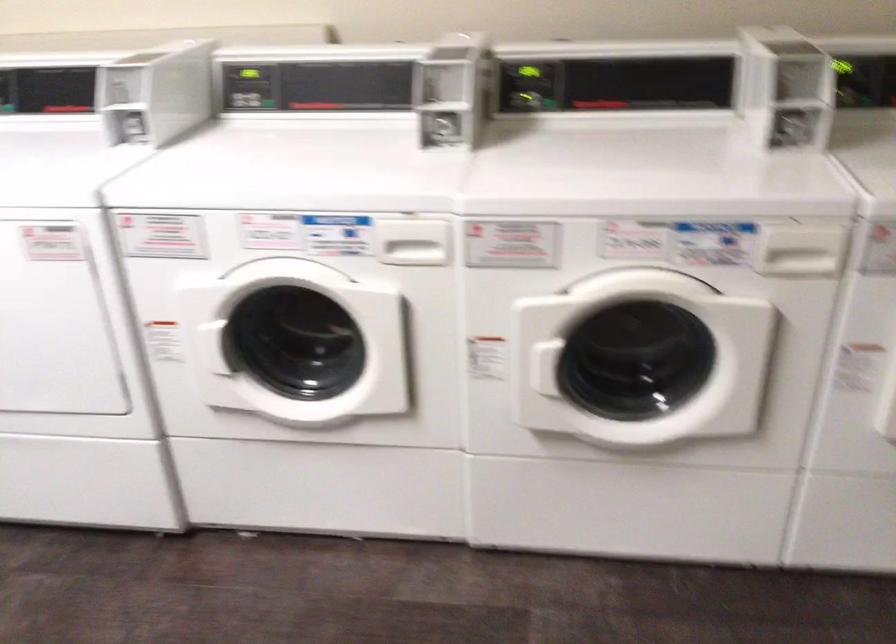
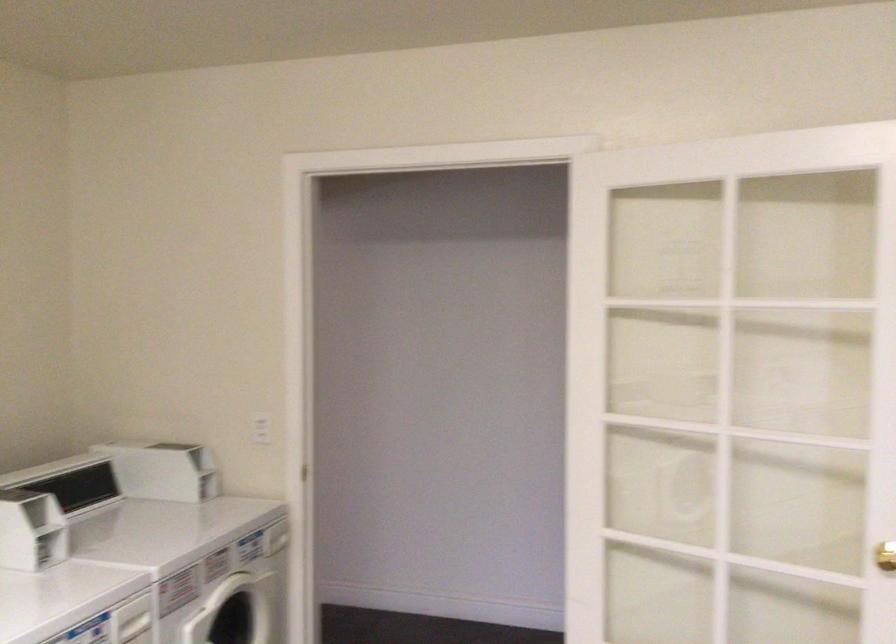
In the second image, find the point that corresponds to point (778, 258) in the first image.

(133, 621)